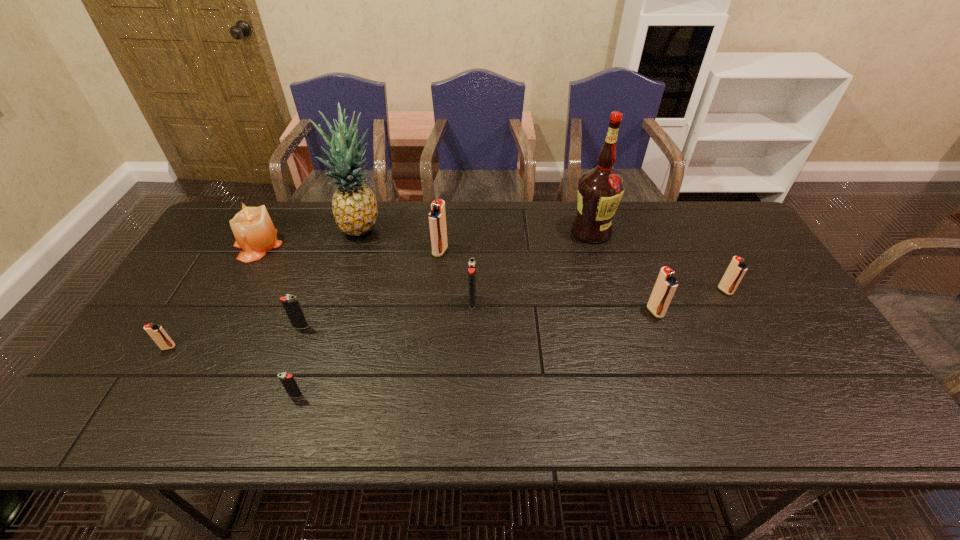
This screenshot has width=960, height=540. I want to click on vacant region that satisfies the following two spatial constraints: 1. on the back side of the sixth farthest igniter; 2. on the right side of the second red igniter from right to left, so click(190, 312).

Image resolution: width=960 pixels, height=540 pixels. What are the coordinates of `free spot that satisfies the following two spatial constraints: 1. on the back side of the sixth igniter from right to left; 2. on the left side of the farthest red igniter` in the screenshot? It's located at (328, 251).

The image size is (960, 540). What are the coordinates of `free spot that satisfies the following two spatial constraints: 1. on the front side of the ninth object from left to right; 2. on the right side of the tallest igniter` in the screenshot? It's located at coord(434,312).